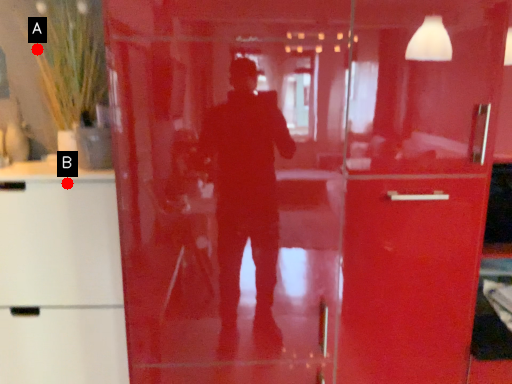
Question: Two points are circled on the image, labeled by A and B beside each circle. Among these points, which one is nearest to the camera?

Choices:
 (A) A is closer
 (B) B is closer

Answer: (B)